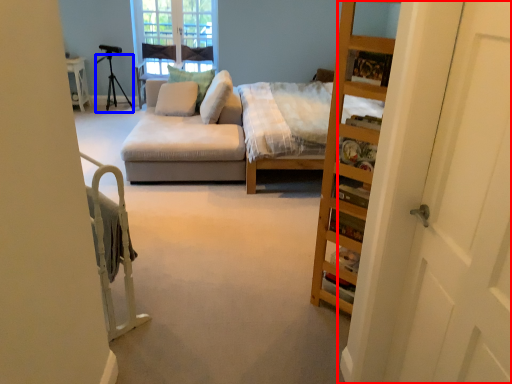
Question: Among these objects, which one is nearest to the camera, door (highlighted by a red box) or tripod (highlighted by a blue box)?

Choices:
 (A) door
 (B) tripod

Answer: (A)